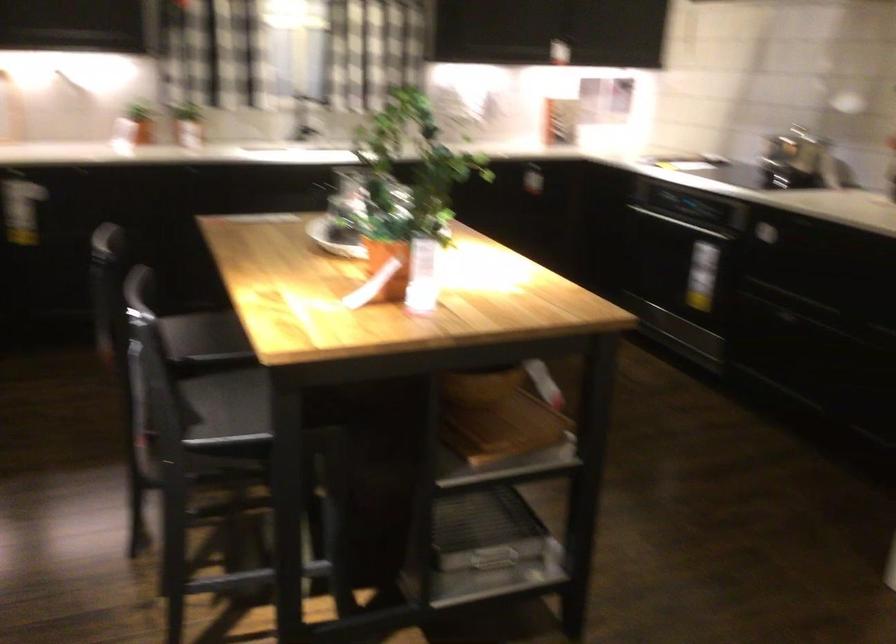
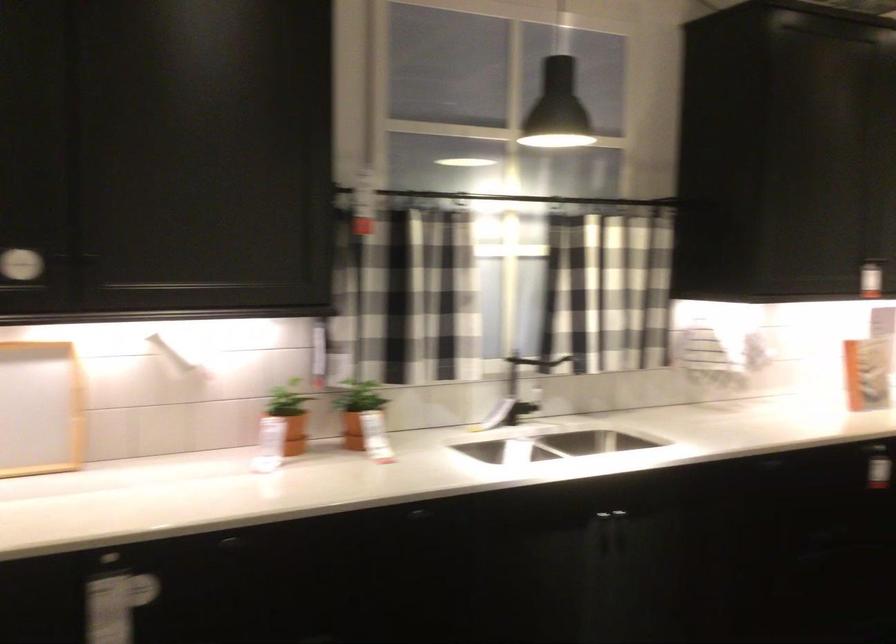
In the second image, find the point that corresponds to (321,97) in the first image.

(538, 366)